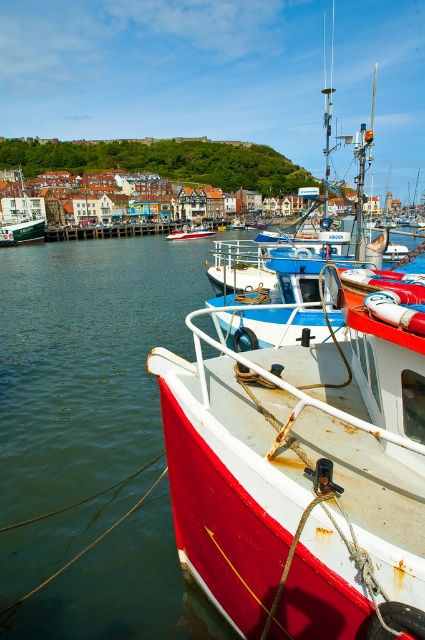
Which is behind, point (37, 433) or point (40, 209)?

The point (40, 209) is more distant.

Describe the element at coordinates (34, 374) in the screenshot. I see `smooth water at center` at that location.

Where is `smooth water at center`? This screenshot has width=425, height=640. smooth water at center is located at coordinates (34, 374).

Between white matte boat at center and white glossy boat at center, which one has less height?

white glossy boat at center is shorter.

Is point (11, 220) closer to camera compared to point (190, 236)?

No, (11, 220) is behind (190, 236).

The width and height of the screenshot is (425, 640). Find the location of `white matte boat at center`. white matte boat at center is located at coordinates (22, 218).

Is smooth water at center shorter than white glossy boat at center?

No.

Who is taller, smooth water at center or white glossy boat at center?

With more height is smooth water at center.

Identify the location of smooth water at center. Image resolution: width=425 pixels, height=640 pixels. (34, 374).

Locate an element on the screen. smooth water at center is located at coordinates (34, 374).